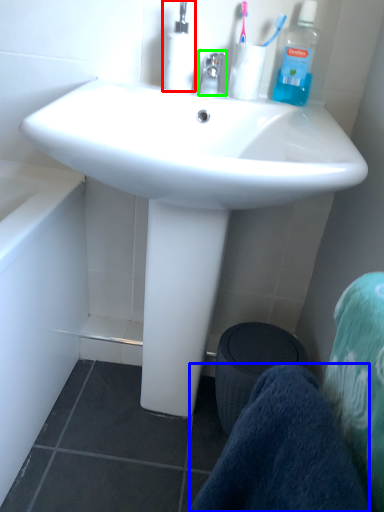
Question: Based on their relative distances, which object is nearer to bottle (highlighted by a red box)? Choose from towel/napkin (highlighted by a blue box) and faucet (highlighted by a green box).

Choices:
 (A) towel/napkin
 (B) faucet

Answer: (B)